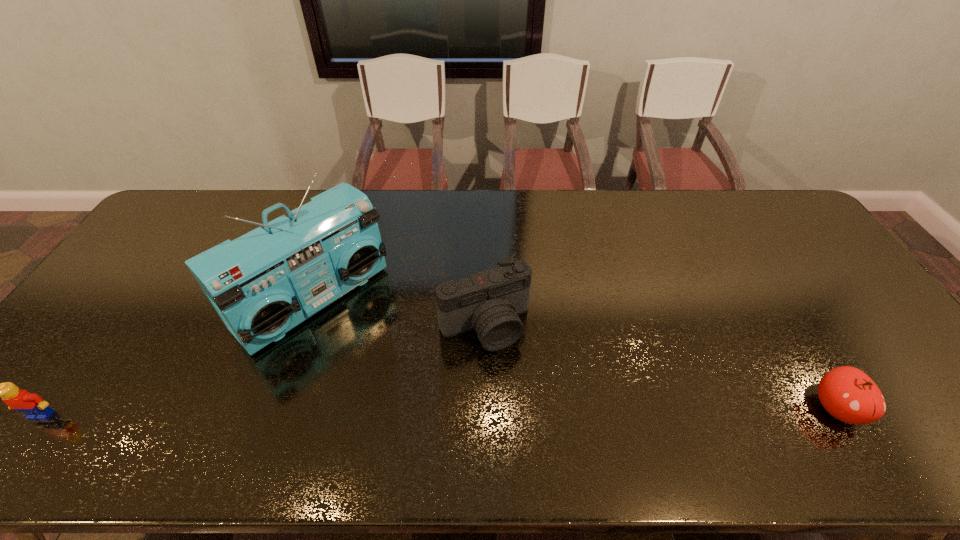
At what (x,y) coordinates should I click in order to perform the action: click on the leftmost object. Please return your answer as a coordinate pair (x, y). Looking at the image, I should click on (31, 404).

Where is `the rightmost object`? the rightmost object is located at coordinates (848, 394).

Find the location of a particular element. This screenshot has height=540, width=960. radio receiver is located at coordinates (263, 284).

The width and height of the screenshot is (960, 540). Identify the location of the tallest object. 263,284.

Image resolution: width=960 pixels, height=540 pixels. Find the location of `camera`. camera is located at coordinates (489, 302).

Image resolution: width=960 pixels, height=540 pixels. What are the coordinates of `the third object from left to right` in the screenshot? It's located at (489, 302).

At what (x,y) coordinates should I click in order to perform the action: click on vacant space located 0.230m on the back of the apple. Please return your answer as a coordinate pair (x, y). The width and height of the screenshot is (960, 540). Looking at the image, I should click on (778, 312).

Identify the location of vacant space located on the front-facing side of the third object from right to left. (372, 354).

Locate an element on the screen. The width and height of the screenshot is (960, 540). free space located on the front-facing side of the third object from right to left is located at coordinates (438, 416).

This screenshot has width=960, height=540. What are the coordinates of `free space located on the front-facing side of the third object from right to left` in the screenshot? It's located at (423, 402).